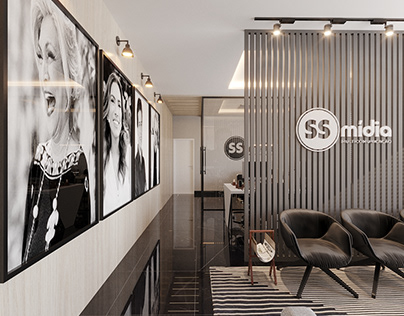
At what (x,y) coordinates should I click in order to perform the action: click on wall. Please return your answer as a coordinate pair (x, y). The width and height of the screenshot is (404, 316). Looking at the image, I should click on (57, 255).